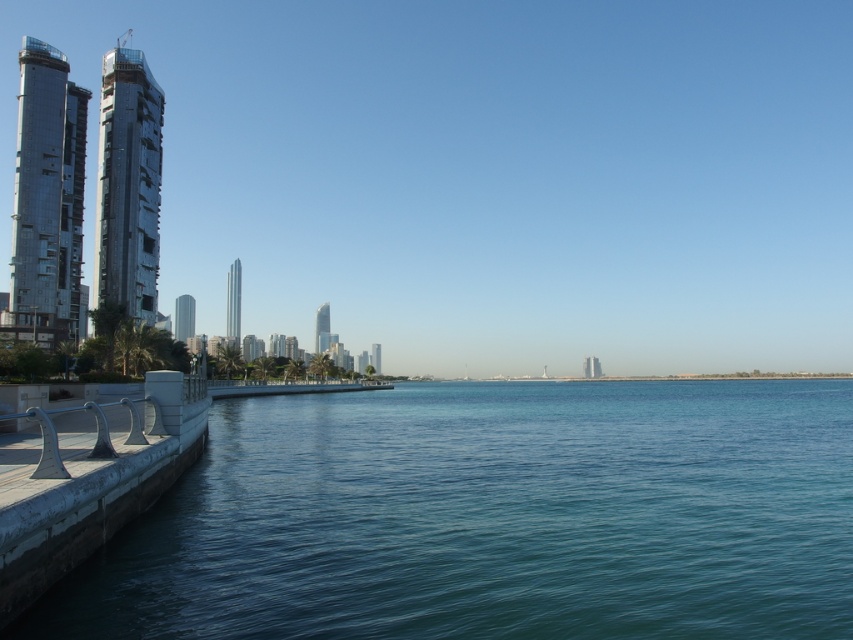
Question: Which point appears farthest from the camera in this image?

Choices:
 (A) (682, 428)
 (B) (132, 467)

Answer: (A)

Question: Is clear blue water at lower left behind white concrete dock at lower left?

Choices:
 (A) yes
 (B) no

Answer: (A)

Question: Which point is closer to the camera taking this photo?

Choices:
 (A) (82, 504)
 (B) (119, 548)

Answer: (A)

Question: Can you confirm if clear blue water at lower left is thinner than white concrete dock at lower left?

Choices:
 (A) no
 (B) yes

Answer: (A)

Question: Which object is farther from the camera taking this photo?

Choices:
 (A) clear blue water at lower left
 (B) white concrete dock at lower left

Answer: (A)

Question: Is clear blue water at lower left to the right of white concrete dock at lower left from the viewer's perspective?

Choices:
 (A) no
 (B) yes

Answer: (B)